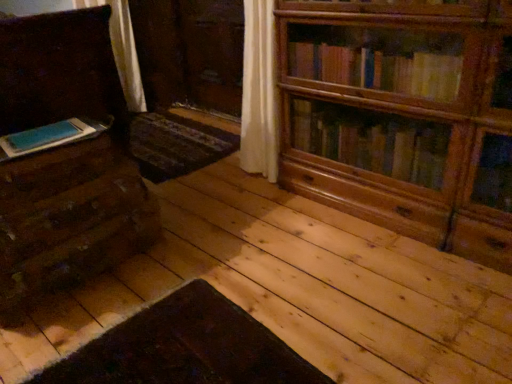
The height and width of the screenshot is (384, 512). I want to click on free space below blue matte book at left (from a real-world perspective), so click(58, 128).